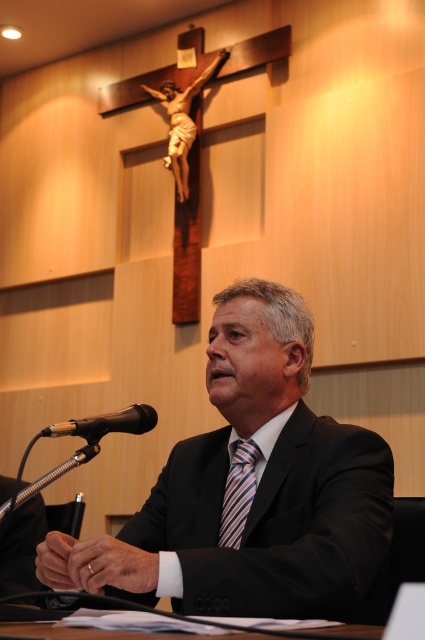
You are organizing a conference and need to ensure that the black suit at center and the black matte microphone at lower left are visible to all attendees. Considering their sizes, which object should be placed closer to the front of the stage to ensure visibility?

The black suit at center is wider than the black matte microphone at lower left, so placing it closer to the front would ensure better visibility for all attendees.

You are a photographer setting up for a professional photoshoot. You need to ensure that the striped silk tie at center and the black matte microphone at lower left are both visible in the frame. Based on their positions, which object is closer to the camera?

The striped silk tie at center is positioned under the black matte microphone at lower left, meaning the microphone is closer to the camera. Therefore, the black matte microphone at lower left is closer to the camera.

You are standing in front of the scene and want to know the exact position of the black suit at center. Can you tell me where it is located in terms of coordinates?

The black suit at center is located at coordinates point (255, 490).